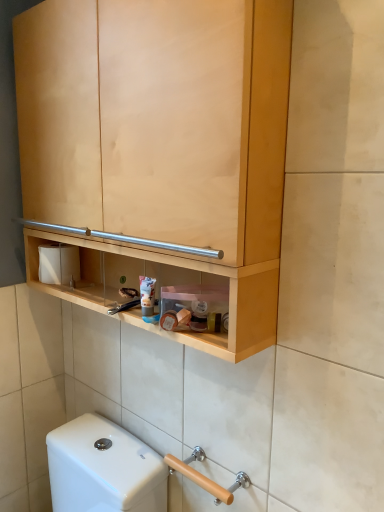
Question: In the image, is white matte toilet paper at left positioned in front of or behind beige wood grab bar at lower right?

Choices:
 (A) behind
 (B) front

Answer: (A)

Question: In terms of size, does white matte toilet paper at left appear bigger or smaller than beige wood grab bar at lower right?

Choices:
 (A) big
 (B) small

Answer: (A)

Question: Which object is the farthest from the matte plastic tube at center?

Choices:
 (A) white matte toilet paper at left
 (B) natural wood cabinet at upper center
 (C) beige wood grab bar at lower right

Answer: (C)

Question: Which is nearer to the natural wood cabinet at upper center?

Choices:
 (A) white matte toilet paper at left
 (B) matte plastic tube at center
 (C) beige wood grab bar at lower right

Answer: (B)